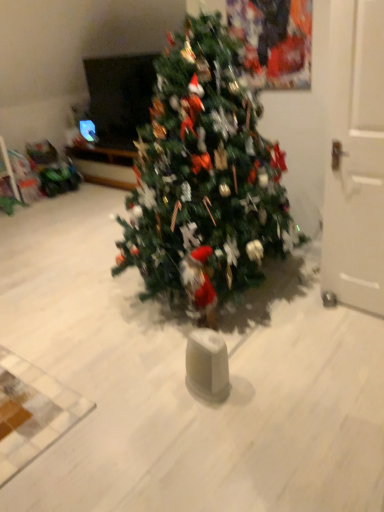
The width and height of the screenshot is (384, 512). Identify the location of empty space that is in between green matte christmas tree at center and white matte door at right. (301, 320).